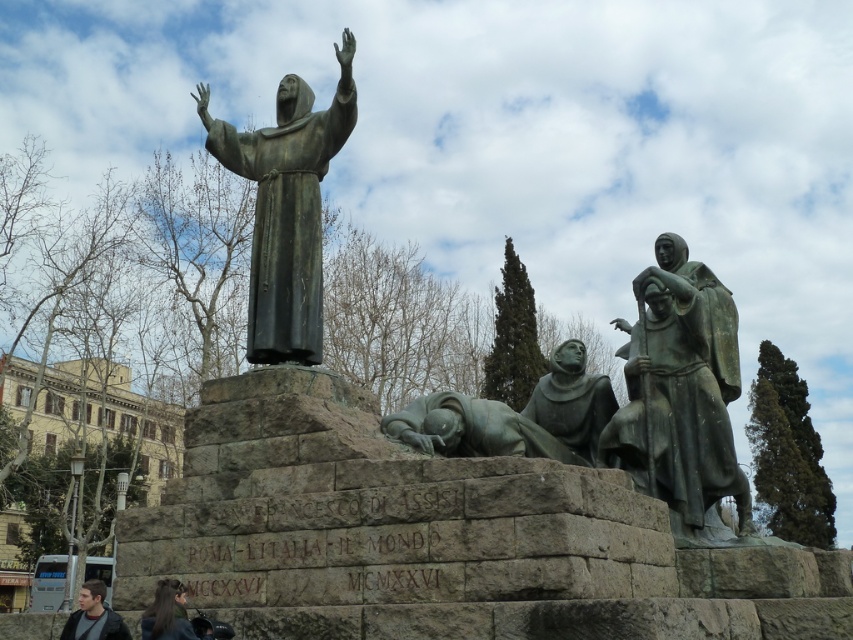
Question: Is dark gray jacket at lower left to the right of dark brown hair at lower left from the viewer's perspective?

Choices:
 (A) no
 (B) yes

Answer: (A)

Question: Among these points, which one is nearest to the camera?

Choices:
 (A) (677, 449)
 (B) (605, 401)
 (C) (106, 625)
 (D) (196, 84)

Answer: (C)

Question: Considering the real-world distances, which object is closest to the bronze statue of monks at center?

Choices:
 (A) green patina statue at center
 (B) dark gray jacket at lower left
 (C) bronze statue at upper center

Answer: (A)

Question: Is green patina statue at center behind dark brown hair at lower left?

Choices:
 (A) no
 (B) yes

Answer: (B)

Question: Does bronze statue at upper center have a greater width compared to bronze statue of monks at center?

Choices:
 (A) no
 (B) yes

Answer: (B)

Question: Among these points, which one is farthest from the camera?

Choices:
 (A) (65, 636)
 (B) (167, 604)

Answer: (A)